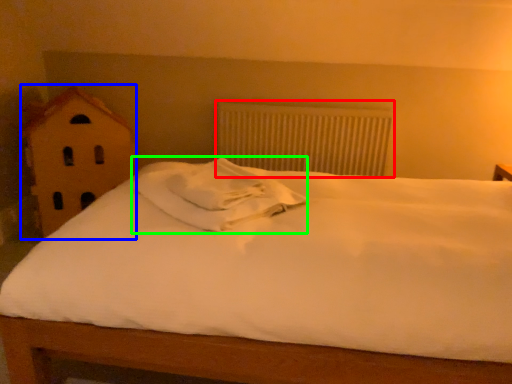
Question: Based on their relative distances, which object is nearer to radiator (highlighted by a red box)? Choose from toy (highlighted by a blue box) and pillow (highlighted by a green box).

Choices:
 (A) toy
 (B) pillow

Answer: (A)